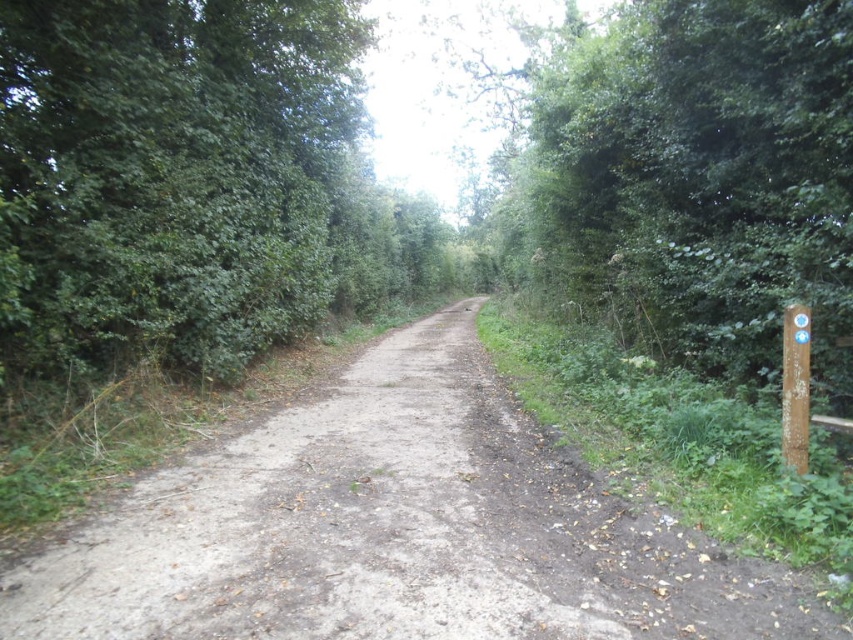
Question: Which object appears farthest from the camera in this image?

Choices:
 (A) dull brown dirt track at center
 (B) green leafy bush at left
 (C) green leafy tree at right

Answer: (B)

Question: Does green leafy bush at left have a smaller size compared to green leafy tree at right?

Choices:
 (A) yes
 (B) no

Answer: (B)

Question: Which object is farther from the camera taking this photo?

Choices:
 (A) green leafy tree at right
 (B) green leafy bush at left
 (C) dull brown dirt track at center

Answer: (B)

Question: Which of these objects is positioned farthest from the dull brown dirt track at center?

Choices:
 (A) green leafy tree at right
 (B) green leafy bush at left

Answer: (A)

Question: Does green leafy bush at left appear over green leafy tree at right?

Choices:
 (A) yes
 (B) no

Answer: (B)

Question: Is green leafy bush at left to the left of green leafy tree at right from the viewer's perspective?

Choices:
 (A) no
 (B) yes

Answer: (B)